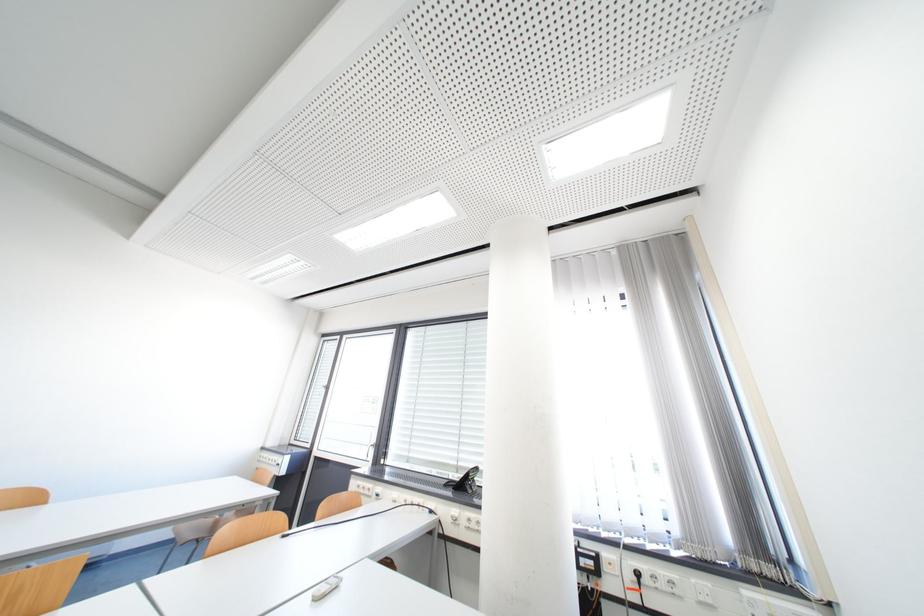
Describe the element at coordinates (638, 576) in the screenshot. I see `a black cable plug` at that location.